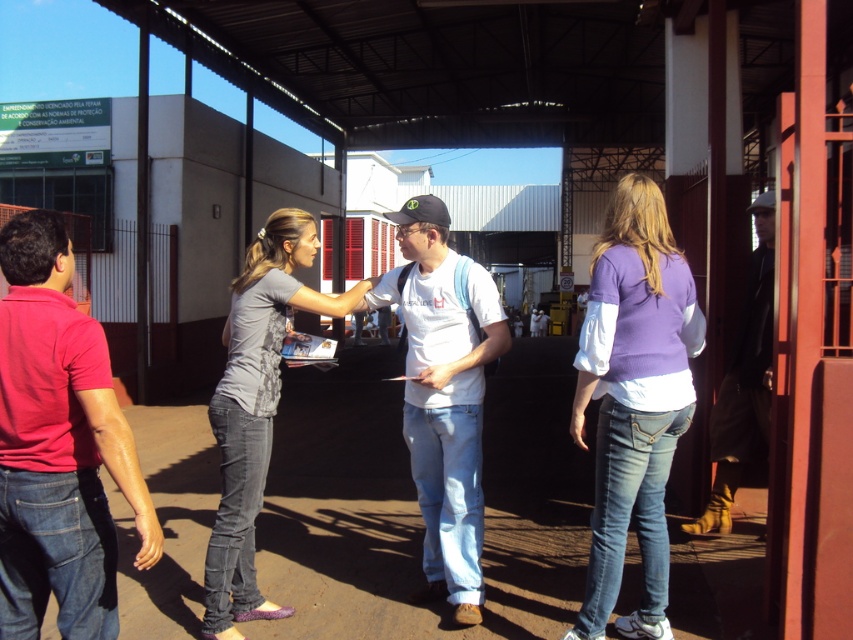
Question: Considering the relative positions of purple knit sweater at center and white cotton t-shirt at center in the image provided, where is purple knit sweater at center located with respect to white cotton t-shirt at center?

Choices:
 (A) below
 (B) above

Answer: (B)

Question: Does matte red shirt at left have a greater width compared to white cotton t-shirt at center?

Choices:
 (A) yes
 (B) no

Answer: (B)

Question: Which object appears closest to the camera in this image?

Choices:
 (A) dark brown leather jacket at right
 (B) gray cotton shirt at center

Answer: (B)

Question: Which of these objects is positioned closest to the gray cotton shirt at center?

Choices:
 (A) dark brown leather jacket at right
 (B) purple knit sweater at center

Answer: (B)

Question: Which point is farther to the camera?

Choices:
 (A) white cotton t-shirt at center
 (B) purple knit sweater at center
 (C) matte red shirt at left
 (D) dark brown leather jacket at right

Answer: (D)

Question: From the image, what is the correct spatial relationship of white cotton t-shirt at center in relation to gray cotton shirt at center?

Choices:
 (A) left
 (B) right

Answer: (B)